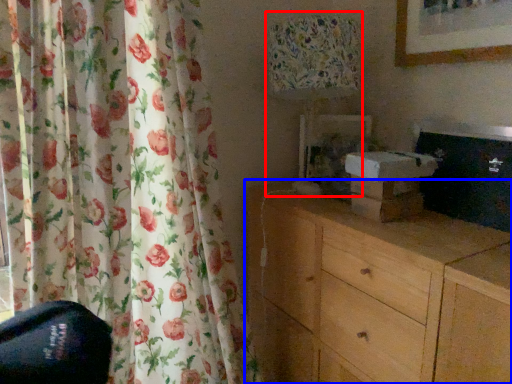
Question: Which object appears farthest to the camera in this image, table lamp (highlighted by a red box) or chest of drawers (highlighted by a blue box)?

Choices:
 (A) table lamp
 (B) chest of drawers

Answer: (A)